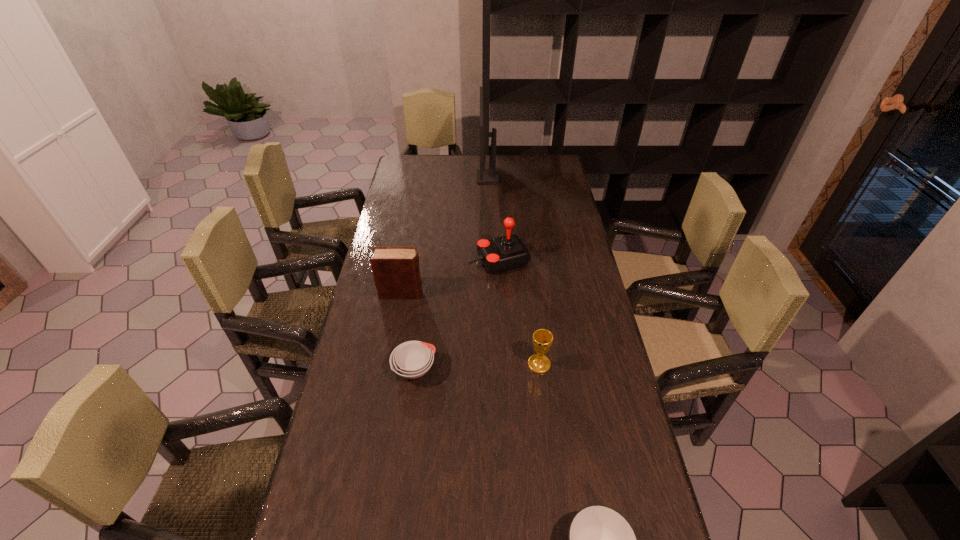
At what (x,y) coordinates should I click in order to perform the action: click on the tallest object. Please return your answer as a coordinate pair (x, y). Looking at the image, I should click on (484, 176).

Where is `computer monitor`? This screenshot has width=960, height=540. computer monitor is located at coordinates (484, 176).

Identify the location of joystick. The width and height of the screenshot is (960, 540). (508, 252).

Locate an element on the screen. The image size is (960, 540). the third farthest object is located at coordinates (396, 271).

Find the location of a particular element. Image resolution: width=960 pixels, height=540 pixels. chalice is located at coordinates coord(542,338).

Locate an element on the screen. the shortest object is located at coordinates (412, 359).

Where is `the shorter soup bowl`? The height and width of the screenshot is (540, 960). the shorter soup bowl is located at coordinates (412, 359).

Where is `blank area located on the front-facing side of the computer monitor`? This screenshot has height=540, width=960. blank area located on the front-facing side of the computer monitor is located at coordinates (399, 177).

You are a GUI agent. You are given a task and a screenshot of the screen. Output one action in this format:
    pyautogui.click(x=<x>, y=<y>)
    Task: Click on the vacant area situated on the front-facing side of the computer monitor
    
    Given the screenshot: What is the action you would take?
    pyautogui.click(x=412, y=177)

The image size is (960, 540). What are the coordinates of `vacant space located on the front-facing side of the computer monitor` in the screenshot? It's located at (444, 177).